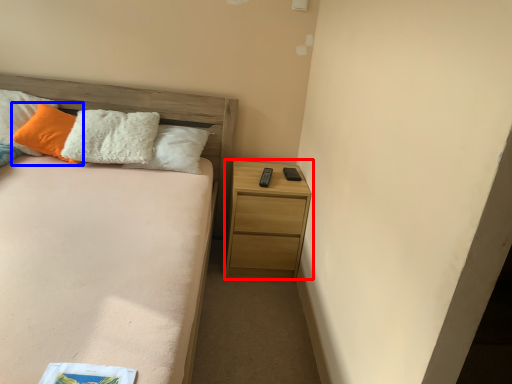
Question: Which object is closer to the camera taking this photo, nightstand (highlighted by a red box) or pillow (highlighted by a blue box)?

Choices:
 (A) nightstand
 (B) pillow

Answer: (B)